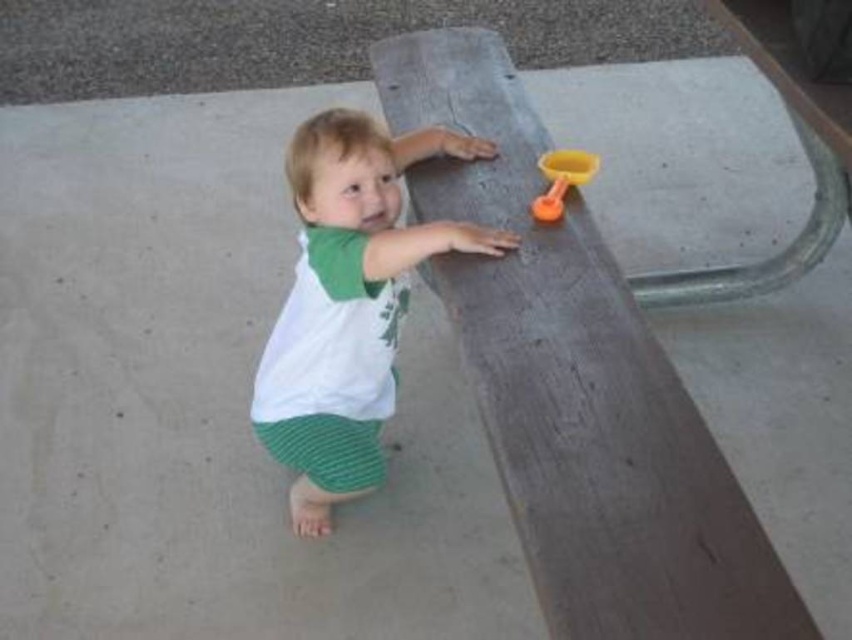
Can you confirm if brown wood picnic table at center is shorter than translucent orange spoon at upper right?

In fact, brown wood picnic table at center may be taller than translucent orange spoon at upper right.

Between brown wood picnic table at center and translucent orange spoon at upper right, which one is positioned higher?

Positioned higher is translucent orange spoon at upper right.

Is point (689, 564) positioned in front of point (573, 154)?

Yes.

You are a GUI agent. You are given a task and a screenshot of the screen. Output one action in this format:
    pyautogui.click(x=<x>, y=<y>)
    Task: Click on the brown wood picnic table at center
    
    Given the screenshot: What is the action you would take?
    coord(579,385)

Is brown wood picnic table at center taller than white cotton shirt at center?

Yes, brown wood picnic table at center is taller than white cotton shirt at center.

Is point (539, 227) positioned after point (354, 355)?

No, it is not.

Describe the element at coordinates (579, 385) in the screenshot. I see `brown wood picnic table at center` at that location.

The width and height of the screenshot is (852, 640). Identify the location of brown wood picnic table at center. (579, 385).

Is white cotton shirt at center closer to the viewer compared to translucent orange spoon at upper right?

Yes.

Is white cotton shirt at center positioned at the back of translucent orange spoon at upper right?

No, white cotton shirt at center is closer to the viewer.

Does point (327, 513) come in front of point (534, 204)?

No, (327, 513) is further to viewer.

What are the coordinates of `white cotton shirt at center` in the screenshot? It's located at (349, 301).